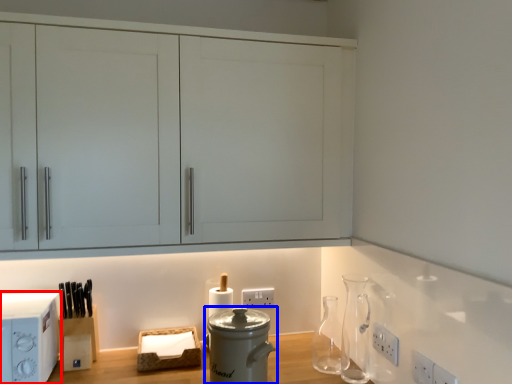
Question: Which point is further to the camera, home appliance (highlighted by a red box) or kitchen appliance (highlighted by a blue box)?

Choices:
 (A) home appliance
 (B) kitchen appliance

Answer: (A)